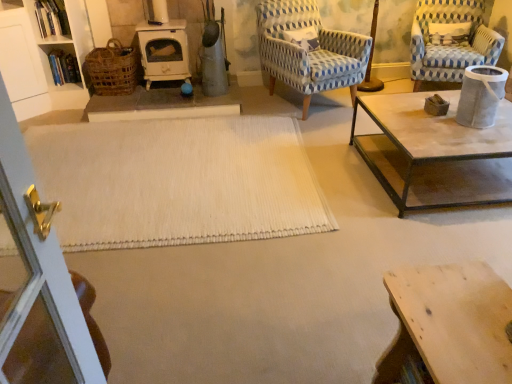
Find the location of a particular element. white woven rug at center is located at coordinates (177, 181).

Describe the element at coordinates (111, 70) in the screenshot. I see `woven brown basket at left` at that location.

This screenshot has width=512, height=384. I want to click on wooden table at lower right, so click(x=449, y=324).

Which object is positioned more to the left, white woven rug at center or blue and white checkered fabric armchair at upper right, which is the first chair from right to left?

From the viewer's perspective, white woven rug at center appears more on the left side.

Can you confirm if white woven rug at center is thinner than blue and white checkered fabric armchair at upper right, which is the 2th chair from left to right?

Incorrect, the width of white woven rug at center is not less than that of blue and white checkered fabric armchair at upper right, which is the 2th chair from left to right.

Where is `plain that is below the blue and white checkered fabric armchair at upper right, which is the 2th chair from left to right (from the image's perspective)`? The image size is (512, 384). plain that is below the blue and white checkered fabric armchair at upper right, which is the 2th chair from left to right (from the image's perspective) is located at coordinates (177, 181).

Is blue and white checkered fabric armchair at upper right, which is the 2th chair from left to right, far from white woven rug at center?

Yes, blue and white checkered fabric armchair at upper right, which is the 2th chair from left to right, is far from white woven rug at center.

Considering the relative sizes of woven brown basket at left and blue woven fabric chair at upper right, which appears as the first chair when viewed from the left, in the image provided, is woven brown basket at left bigger than blue woven fabric chair at upper right, which appears as the first chair when viewed from the left,?

Incorrect, woven brown basket at left is not larger than blue woven fabric chair at upper right, which appears as the first chair when viewed from the left.

Which is behind, woven brown basket at left or blue woven fabric chair at upper right, placed as the second chair when sorted from right to left?

woven brown basket at left is further from the camera.

How much distance is there between woven brown basket at left and blue woven fabric chair at upper right, which appears as the first chair when viewed from the left?

4.92 feet.

Is point (89, 63) farther from viewer compared to point (285, 40)?

No.

Would you say wooden table at lower right contains white woven rug at center?

Definitely not — white woven rug at center is not inside wooden table at lower right.

From a real-world perspective, relative to white woven rug at center, is wooden table at lower right vertically above or below?

wooden table at lower right is above white woven rug at center.

What's the angular difference between wooden table at lower right and white woven rug at center's facing directions?

There is a 179-degree angle between the facing directions of wooden table at lower right and white woven rug at center.

From the image's perspective, between wooden table at lower right and white woven rug at center, who is located below?

From the image's view, wooden table at lower right is below.

From their relative heights in the image, would you say blue and white checkered fabric armchair at upper right, which is the 2th chair from left to right, is taller or shorter than woven brown basket at left?

Clearly, blue and white checkered fabric armchair at upper right, which is the 2th chair from left to right, is taller compared to woven brown basket at left.

Is blue and white checkered fabric armchair at upper right, which is the 2th chair from left to right, placed right next to woven brown basket at left?

They are not placed beside each other.

Is blue and white checkered fabric armchair at upper right, which is the first chair from right to left, positioned with its back to woven brown basket at left?

No, blue and white checkered fabric armchair at upper right, which is the first chair from right to left,'s orientation is not away from woven brown basket at left.

Is wooden table at lower right to the left of blue and white checkered fabric armchair at upper right, which is the first chair from right to left, from the viewer's perspective?

Correct, you'll find wooden table at lower right to the left of blue and white checkered fabric armchair at upper right, which is the first chair from right to left.

Looking at their sizes, would you say wooden table at lower right is wider or thinner than blue and white checkered fabric armchair at upper right, which is the first chair from right to left?

wooden table at lower right is thinner than blue and white checkered fabric armchair at upper right, which is the first chair from right to left.

Is wooden table at lower right oriented towards blue and white checkered fabric armchair at upper right, which is the 2th chair from left to right?

No, wooden table at lower right does not turn towards blue and white checkered fabric armchair at upper right, which is the 2th chair from left to right.

Is wooden table at lower right placed right next to blue and white checkered fabric armchair at upper right, which is the first chair from right to left?

wooden table at lower right and blue and white checkered fabric armchair at upper right, which is the first chair from right to left, are not in contact.

Considering the positions of points (98, 89) and (197, 162), is point (98, 89) closer to camera compared to point (197, 162)?

No, it is behind (197, 162).

From a real-world perspective, which is physically above, woven brown basket at left or white woven rug at center?

From a 3D spatial view, woven brown basket at left is above.

Considering the positions of objects woven brown basket at left and white woven rug at center in the image provided, who is behind, woven brown basket at left or white woven rug at center?

A: woven brown basket at left is further away from the camera.

Locate an element on the screen. Image resolution: width=512 pixels, height=384 pixels. plain lying in front of the woven brown basket at left is located at coordinates (177, 181).

The height and width of the screenshot is (384, 512). In the image, there is a blue and white checkered fabric armchair at upper right, which is the 2th chair from left to right. What are the coordinates of `plain below it (from the image's perspective)` in the screenshot? It's located at (177, 181).

There is a white woven rug at center. Where is `the 2nd chair above it (from a real-world perspective)`? the 2nd chair above it (from a real-world perspective) is located at coordinates (452, 44).

Estimate the real-world distances between objects in this image. Which object is further from blue woven fabric chair at upper right, placed as the second chair when sorted from right to left, woven brown basket at left or white woven rug at center?

woven brown basket at left is further to blue woven fabric chair at upper right, placed as the second chair when sorted from right to left.

Considering their positions, is white woven rug at center positioned further to blue woven fabric chair at upper right, placed as the second chair when sorted from right to left, than wooden table at lower right?

Based on the image, wooden table at lower right appears to be further to blue woven fabric chair at upper right, placed as the second chair when sorted from right to left.

Looking at the image, which one is located closer to blue woven fabric chair at upper right, which appears as the first chair when viewed from the left, blue and white checkered fabric armchair at upper right, which is the first chair from right to left, or white woven rug at center?

blue and white checkered fabric armchair at upper right, which is the first chair from right to left, lies closer to blue woven fabric chair at upper right, which appears as the first chair when viewed from the left, than the other object.

From the image, which object appears to be nearer to blue woven fabric chair at upper right, placed as the second chair when sorted from right to left, wooden table at lower right or white woven rug at center?

white woven rug at center lies closer to blue woven fabric chair at upper right, placed as the second chair when sorted from right to left, than the other object.

Considering their positions, is blue woven fabric chair at upper right, placed as the second chair when sorted from right to left, positioned closer to white woven rug at center than wooden table at lower right?

Based on the image, blue woven fabric chair at upper right, placed as the second chair when sorted from right to left, appears to be nearer to white woven rug at center.

Which object lies further to the anchor point wooden table at lower right, blue woven fabric chair at upper right, which appears as the first chair when viewed from the left, or blue and white checkered fabric armchair at upper right, which is the first chair from right to left?

The object further to wooden table at lower right is blue and white checkered fabric armchair at upper right, which is the first chair from right to left.

Based on their spatial positions, is blue woven fabric chair at upper right, placed as the second chair when sorted from right to left, or white woven rug at center closer to blue and white checkered fabric armchair at upper right, which is the first chair from right to left?

The object closer to blue and white checkered fabric armchair at upper right, which is the first chair from right to left, is blue woven fabric chair at upper right, placed as the second chair when sorted from right to left.

Looking at the image, which one is located closer to blue and white checkered fabric armchair at upper right, which is the 2th chair from left to right, white woven rug at center or wooden table at lower right?

Based on the image, white woven rug at center appears to be nearer to blue and white checkered fabric armchair at upper right, which is the 2th chair from left to right.

You are a GUI agent. You are given a task and a screenshot of the screen. Output one action in this format:
    pyautogui.click(x=<x>, y=<y>)
    Task: Click on the plain between wooden table at lower right and woven brown basket at left along the z-axis
    This screenshot has width=512, height=384.
    Given the screenshot: What is the action you would take?
    pyautogui.click(x=177, y=181)

What are the coordinates of `plain situated between woven brown basket at left and blue and white checkered fabric armchair at upper right, which is the first chair from right to left, from left to right` in the screenshot? It's located at (177, 181).

I want to click on table between white woven rug at center and blue and white checkered fabric armchair at upper right, which is the first chair from right to left, so click(449, 324).

Locate an element on the screen. The width and height of the screenshot is (512, 384). chair situated between white woven rug at center and blue and white checkered fabric armchair at upper right, which is the 2th chair from left to right, from left to right is located at coordinates (309, 50).